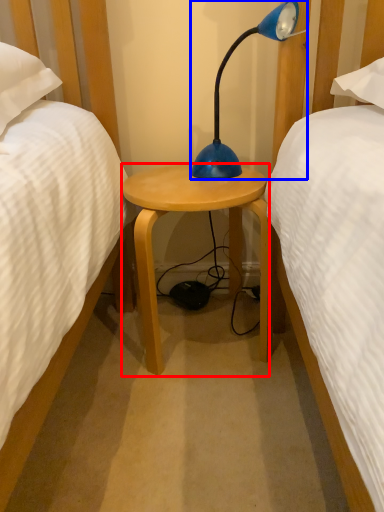
Question: Which point is further to the camera, stool (highlighted by a red box) or lamp (highlighted by a blue box)?

Choices:
 (A) stool
 (B) lamp

Answer: (A)